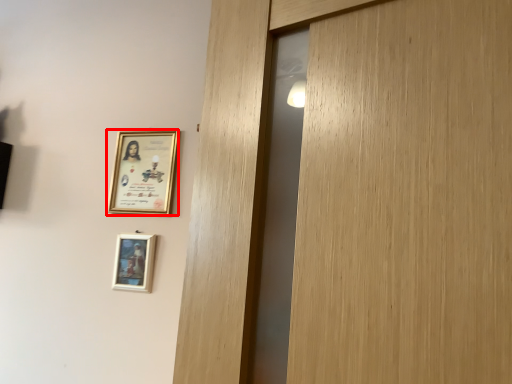
Question: In this image, where is picture frame (annotated by the red box) located relative to picture frame?

Choices:
 (A) right
 (B) left

Answer: (A)